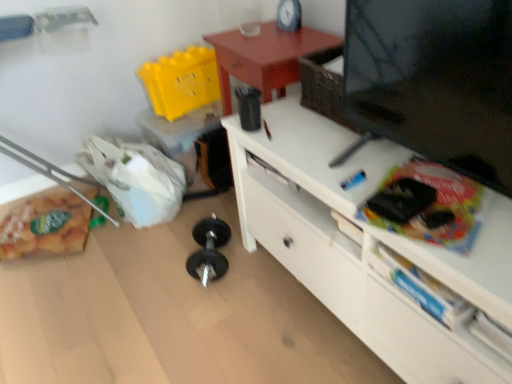
Question: Does white matte drawer at lower right come behind black matte tv at upper right?

Choices:
 (A) yes
 (B) no

Answer: (A)

Question: Is white matte drawer at lower right taller than black matte tv at upper right?

Choices:
 (A) no
 (B) yes

Answer: (A)

Question: Can you confirm if white matte drawer at lower right is thinner than black matte tv at upper right?

Choices:
 (A) no
 (B) yes

Answer: (B)

Question: Is black matte tv at upper right located within white matte drawer at lower right?

Choices:
 (A) no
 (B) yes

Answer: (A)

Question: Is white matte drawer at lower right wider than black matte tv at upper right?

Choices:
 (A) yes
 (B) no

Answer: (B)

Question: From a real-world perspective, is matte black clock at upper center physically located above or below white matte drawer at lower right?

Choices:
 (A) below
 (B) above

Answer: (B)

Question: Considering the positions of matte black clock at upper center and white matte drawer at lower right in the image, is matte black clock at upper center bigger or smaller than white matte drawer at lower right?

Choices:
 (A) small
 (B) big

Answer: (A)

Question: Considering the positions of matte black clock at upper center and white matte drawer at lower right in the image, is matte black clock at upper center wider or thinner than white matte drawer at lower right?

Choices:
 (A) wide
 (B) thin

Answer: (B)

Question: Is point (281, 13) closer or farther from the camera than point (422, 369)?

Choices:
 (A) closer
 (B) farther

Answer: (B)

Question: Based on their positions, is black matte tv at upper right located to the left or right of matte black clock at upper center?

Choices:
 (A) right
 (B) left

Answer: (A)

Question: From the image's perspective, is black matte tv at upper right positioned above or below matte black clock at upper center?

Choices:
 (A) above
 (B) below

Answer: (B)

Question: Is point (354, 329) positioned closer to the camera than point (285, 29)?

Choices:
 (A) farther
 (B) closer

Answer: (B)

Question: Choose the correct answer: Is black matte tv at upper right inside matte black clock at upper center or outside it?

Choices:
 (A) inside
 (B) outside

Answer: (B)

Question: Would you say black matte tv at upper right is to the left or to the right of translucent plastic bag at lower left in the picture?

Choices:
 (A) right
 (B) left

Answer: (A)

Question: Is black matte tv at upper right inside or outside of translucent plastic bag at lower left?

Choices:
 (A) inside
 (B) outside

Answer: (B)